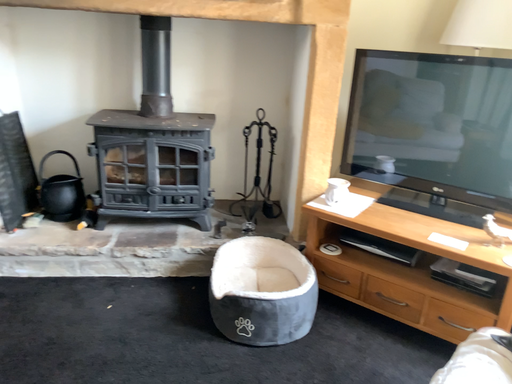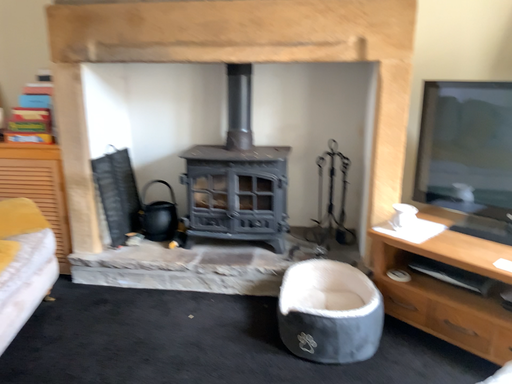
Question: How did the camera likely rotate when shooting the video?

Choices:
 (A) rotated right
 (B) rotated left

Answer: (B)